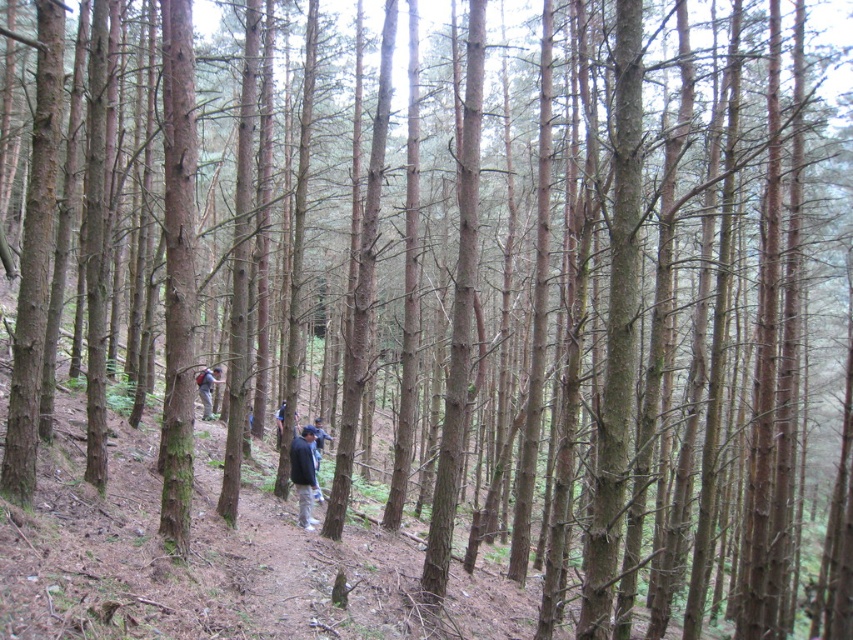
Describe the element at coordinates (303, 474) in the screenshot. The height and width of the screenshot is (640, 853). I see `dark blue jacket at center` at that location.

The height and width of the screenshot is (640, 853). I want to click on dark blue jacket at center, so click(x=303, y=474).